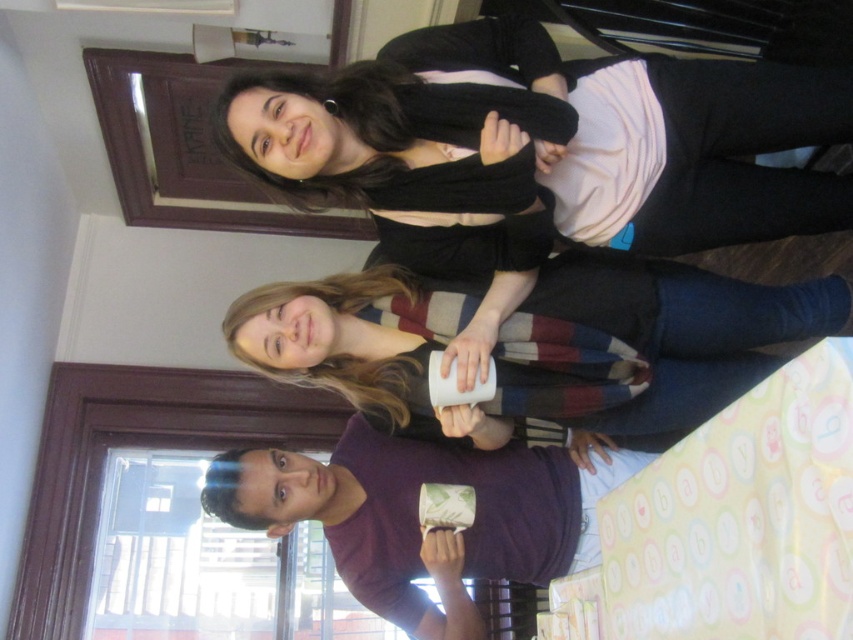
Question: Considering the relative positions of black matte sweater at upper center and matte green fabric mug at lower center in the image provided, where is black matte sweater at upper center located with respect to matte green fabric mug at lower center?

Choices:
 (A) right
 (B) left

Answer: (A)

Question: Which of the following is the farthest from the observer?

Choices:
 (A) matte green fabric mug at lower center
 (B) black matte sweater at upper center

Answer: (A)

Question: Which of the following is the closest to the observer?

Choices:
 (A) white matte mug at center
 (B) black matte sweater at upper center
 (C) matte green fabric mug at lower center

Answer: (B)

Question: Does white matte mug at center appear on the right side of black matte sweater at upper center?

Choices:
 (A) yes
 (B) no

Answer: (B)

Question: Observing the image, what is the correct spatial positioning of black matte sweater at upper center in reference to matte green fabric mug at lower center?

Choices:
 (A) right
 (B) left

Answer: (A)

Question: Which object appears farthest from the camera in this image?

Choices:
 (A) matte green fabric mug at lower center
 (B) white matte mug at center
 (C) black matte sweater at upper center

Answer: (A)